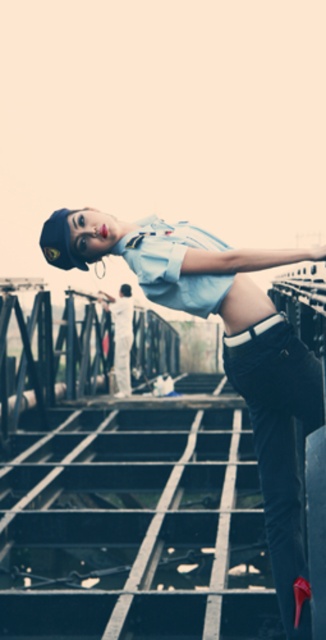
Question: Is light blue uniform at center to the right of velvet black pants at lower right from the viewer's perspective?

Choices:
 (A) yes
 (B) no

Answer: (B)

Question: Which point is closer to the camera?

Choices:
 (A) (293, 452)
 (B) (158, 232)

Answer: (A)

Question: Among these points, which one is nearest to the camera?

Choices:
 (A) (276, 556)
 (B) (278, 538)

Answer: (A)

Question: Does light blue uniform at center appear over velvet black pants at lower right?

Choices:
 (A) yes
 (B) no

Answer: (A)

Question: Is light blue uniform at center smaller than velvet black pants at lower right?

Choices:
 (A) no
 (B) yes

Answer: (A)